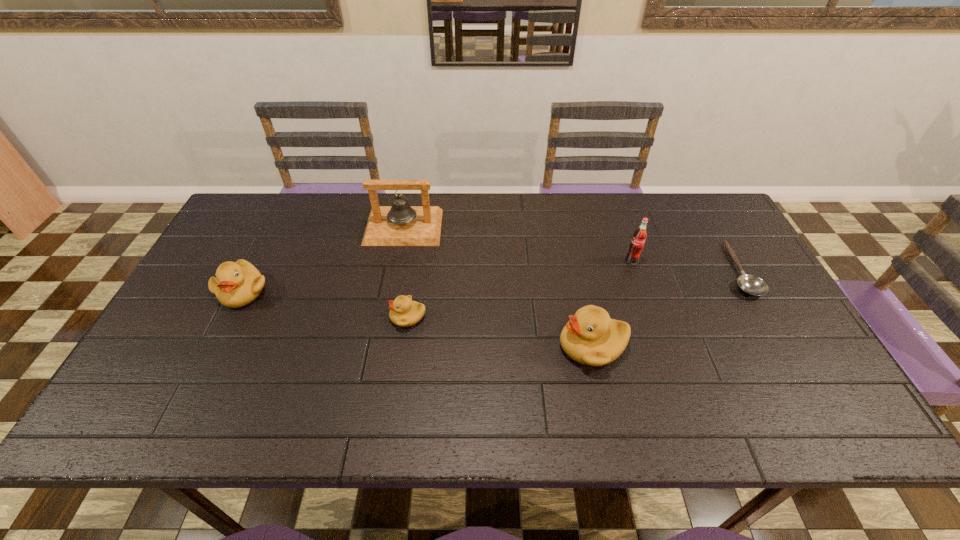
Locate an element on the screen. The image size is (960, 540). duckling that is the third closest one to the second object from right to left is located at coordinates (236, 284).

Where is `the closest duckling to the third shortest object`? This screenshot has height=540, width=960. the closest duckling to the third shortest object is located at coordinates (404, 312).

This screenshot has width=960, height=540. Find the location of `vacant space that satisfies the following two spatial constraints: 1. on the front side of the rightmost object; 2. at the beak of the third object from right to left`. vacant space that satisfies the following two spatial constraints: 1. on the front side of the rightmost object; 2. at the beak of the third object from right to left is located at coordinates (781, 346).

The width and height of the screenshot is (960, 540). What are the coordinates of `vacant region that satisfies the following two spatial constraints: 1. on the front side of the bell; 2. on the left side of the rightmost object` in the screenshot? It's located at (396, 269).

The image size is (960, 540). I want to click on free location that satisfies the following two spatial constraints: 1. on the label of the fifth object from left to right; 2. at the beak of the fourth object from left to right, so click(x=661, y=346).